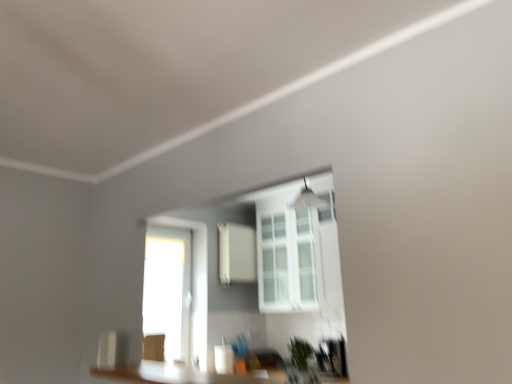
Question: Considering the relative sizes of white glass window at center and white matte medicine cabinet at center in the image provided, is white glass window at center shorter than white matte medicine cabinet at center?

Choices:
 (A) no
 (B) yes

Answer: (A)

Question: From the image's perspective, is white glass window at center located beneath white matte medicine cabinet at center?

Choices:
 (A) no
 (B) yes

Answer: (A)

Question: Is white glass window at center wider than white matte medicine cabinet at center?

Choices:
 (A) no
 (B) yes

Answer: (B)

Question: Does white glass window at center have a lesser width compared to white matte medicine cabinet at center?

Choices:
 (A) yes
 (B) no

Answer: (B)

Question: Would you consider white glass window at center to be distant from white matte medicine cabinet at center?

Choices:
 (A) no
 (B) yes

Answer: (A)

Question: Is white glass window at center at the left side of white matte medicine cabinet at center?

Choices:
 (A) yes
 (B) no

Answer: (B)

Question: Does green matte plant at lower center have a lesser height compared to white glass window at center?

Choices:
 (A) yes
 (B) no

Answer: (A)

Question: Is green matte plant at lower center taller than white glass window at center?

Choices:
 (A) no
 (B) yes

Answer: (A)

Question: From a real-world perspective, does green matte plant at lower center stand above white glass window at center?

Choices:
 (A) no
 (B) yes

Answer: (A)

Question: Does green matte plant at lower center lie behind white glass window at center?

Choices:
 (A) yes
 (B) no

Answer: (B)

Question: Is green matte plant at lower center not within white glass window at center?

Choices:
 (A) yes
 (B) no

Answer: (A)

Question: Considering the relative positions of green matte plant at lower center and white glass window at center in the image provided, is green matte plant at lower center to the left of white glass window at center from the viewer's perspective?

Choices:
 (A) yes
 (B) no

Answer: (A)

Question: Is white matte medicine cabinet at center further to camera compared to white glass window at center?

Choices:
 (A) no
 (B) yes

Answer: (B)